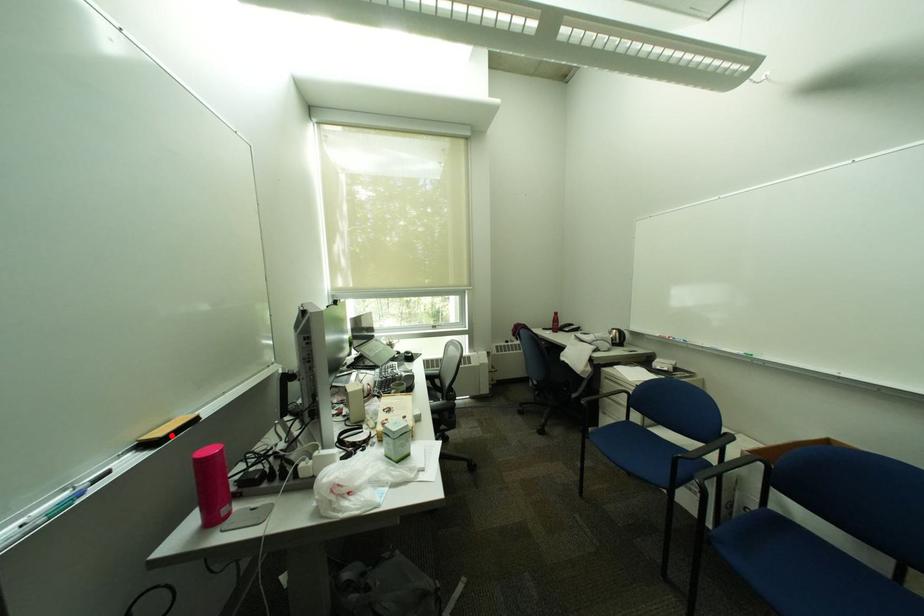
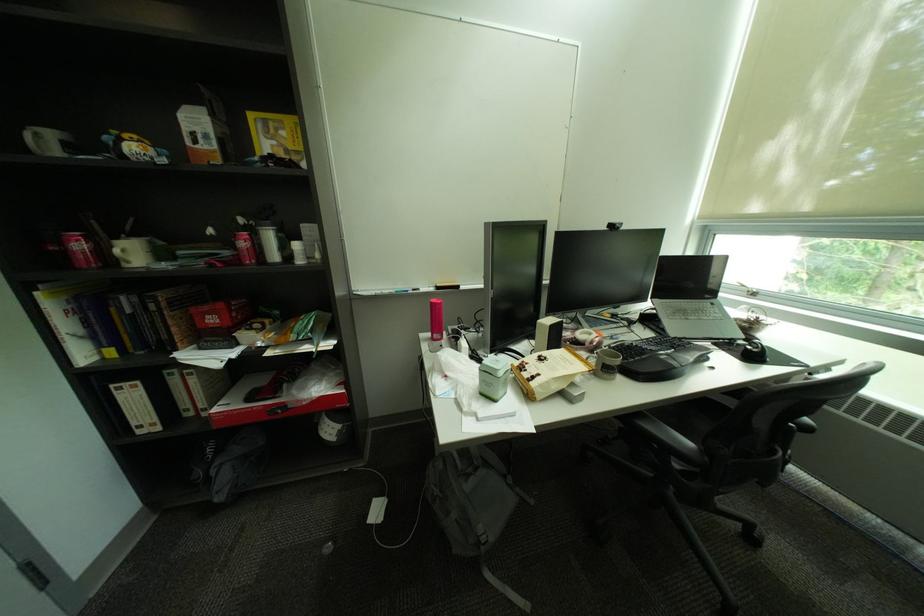
Find the pixel in the second image that matches the highlighted location in the first image.

(450, 286)